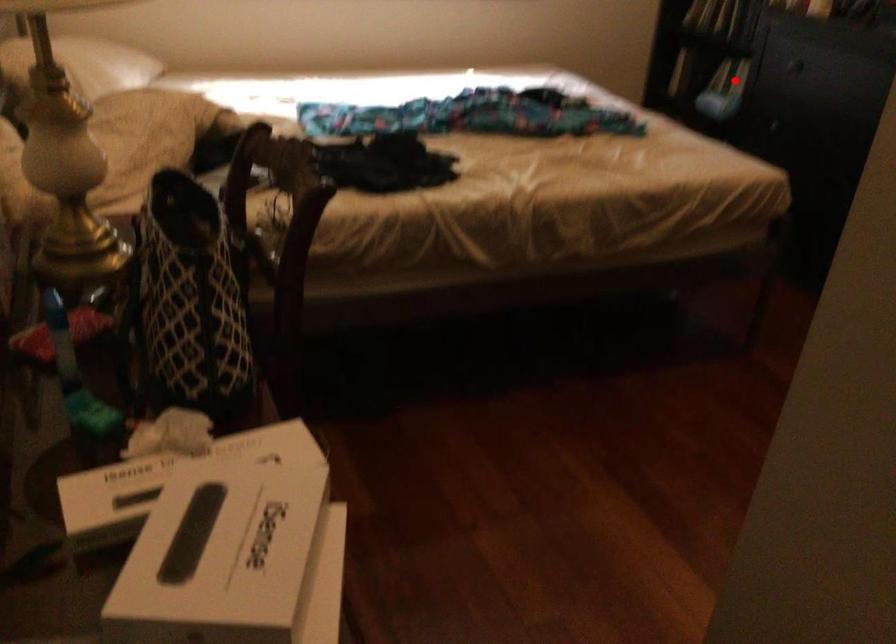
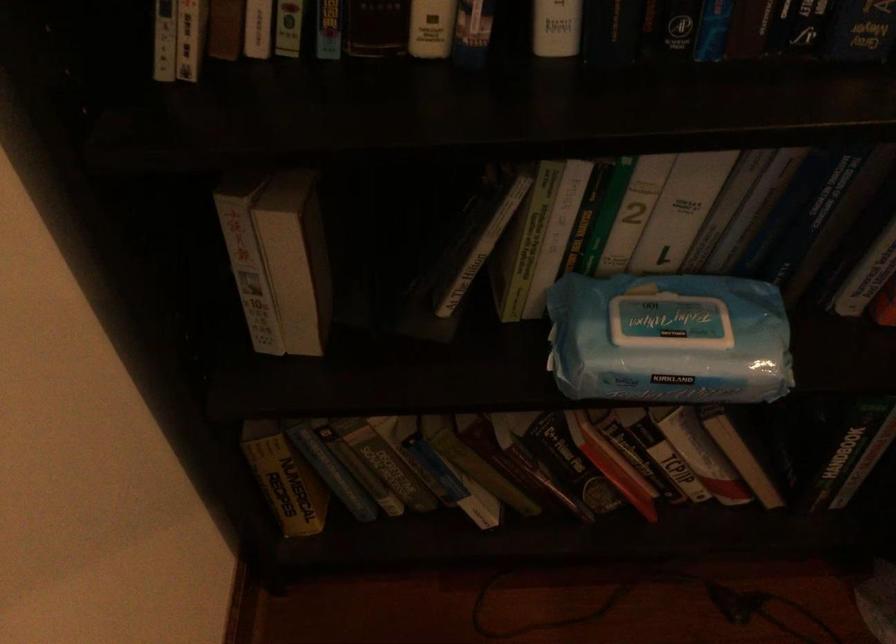
The point at the highlighted location is marked in the first image. Where is the corresponding point in the second image?

(673, 317)